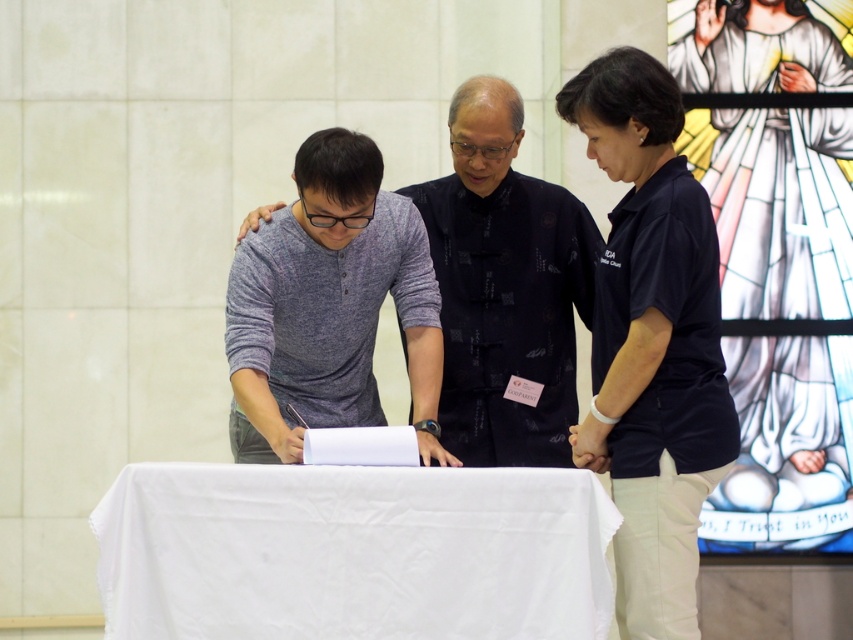
Can you confirm if white cloth-covered table at center is thinner than gray cotton shirt at center?

Incorrect, white cloth-covered table at center's width is not less than gray cotton shirt at center's.

Between point (233, 577) and point (297, 250), which one is positioned in front?

Positioned in front is point (233, 577).

Image resolution: width=853 pixels, height=640 pixels. What do you see at coordinates (352, 552) in the screenshot? I see `white cloth-covered table at center` at bounding box center [352, 552].

Where is `white cloth-covered table at center`? This screenshot has height=640, width=853. white cloth-covered table at center is located at coordinates pyautogui.click(x=352, y=552).

Which is more to the right, purple cotton shirt at center or dark blue shirt at center?

From the viewer's perspective, dark blue shirt at center appears more on the right side.

Based on the photo, is purple cotton shirt at center in front of dark blue shirt at center?

Yes, purple cotton shirt at center is closer to the viewer.

Is point (677, 579) farther from camera compared to point (646, 426)?

That is False.

You are a GUI agent. You are given a task and a screenshot of the screen. Output one action in this format:
    pyautogui.click(x=<x>, y=<y>)
    Task: Click on the purple cotton shirt at center
    This screenshot has width=853, height=640.
    Given the screenshot: What is the action you would take?
    pos(651,342)

Who is shorter, white cloth-covered table at center or dark blue shirt at center?

With less height is white cloth-covered table at center.

Between white cloth-covered table at center and dark blue shirt at center, which one is positioned higher?

Positioned higher is dark blue shirt at center.

Looking at this image, who is more distant from viewer, (529, 566) or (595, 337)?

Point (595, 337)

I want to click on white cloth-covered table at center, so click(352, 552).